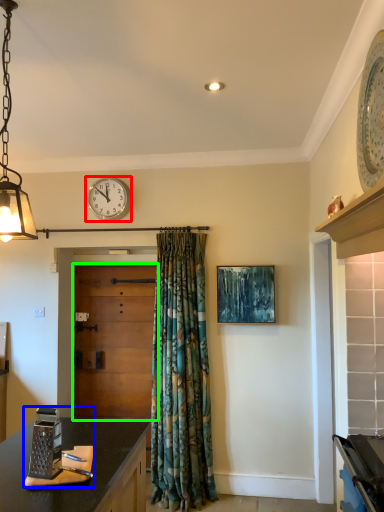
Question: Estimate the real-world distances between objects in this image. Which object is farther from wall clock (highlighted by a red box), appliance (highlighted by a blue box) or door (highlighted by a green box)?

Choices:
 (A) appliance
 (B) door

Answer: (A)